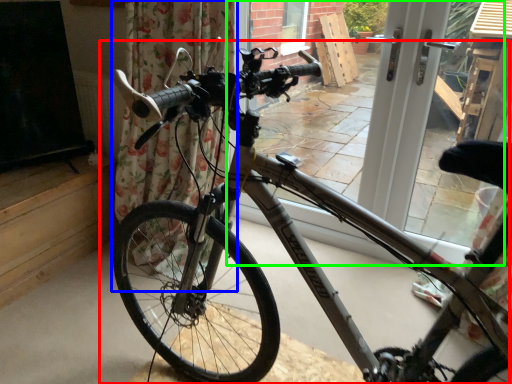
Question: Considering the real-world distances, which object is closest to bicycle (highlighted by a red box)? curtain (highlighted by a blue box) or window frame (highlighted by a green box).

Choices:
 (A) curtain
 (B) window frame

Answer: (A)